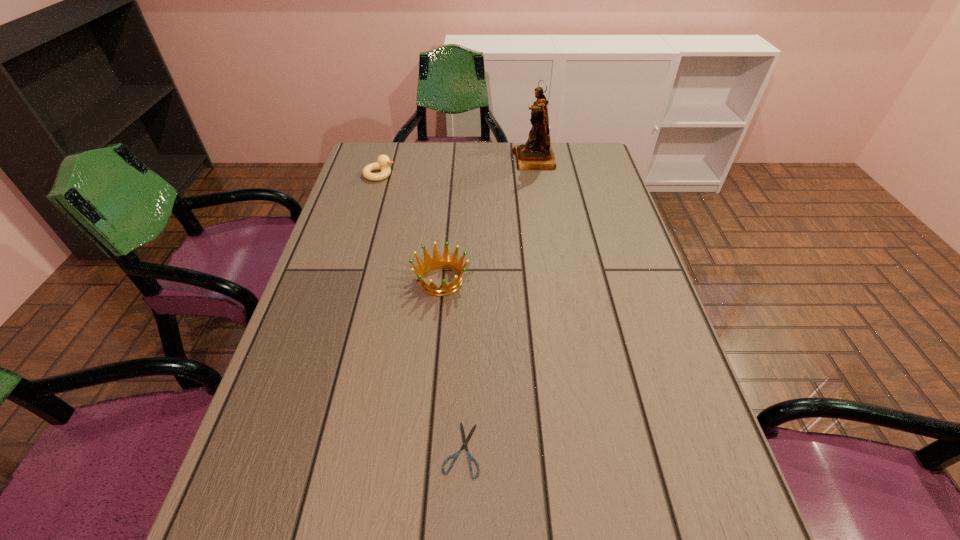
You are a GUI agent. You are given a task and a screenshot of the screen. Output one action in this format:
    pyautogui.click(x=<x>, y=<y>)
    Task: Click on the empty space between the leftmost object and the figurine
    
    Given the screenshot: What is the action you would take?
    pyautogui.click(x=457, y=167)

Find the location of a particular element. The height and width of the screenshot is (540, 960). free space between the duckling and the second nearest object is located at coordinates (410, 228).

Locate an element on the screen. This screenshot has width=960, height=540. object that is the second closest to the second nearest object is located at coordinates (383, 161).

Locate which object is the second closest to the duckling. Please provide its 2D coordinates. Your answer should be formatted as a tuple, i.e. [(x, y)], where the tuple contains the x and y coordinates of a point satisfying the conditions above.

[(536, 154)]

Where is `vacant area in the image that satisfies the following two spatial constraints: 1. at the beak of the second nearest object; 2. on the left side of the leftmost object`? vacant area in the image that satisfies the following two spatial constraints: 1. at the beak of the second nearest object; 2. on the left side of the leftmost object is located at coordinates (348, 281).

Locate an element on the screen. The image size is (960, 540). vacant space that satisfies the following two spatial constraints: 1. at the beak of the shortest object; 2. on the left side of the duckling is located at coordinates (298, 449).

Identify the location of free space that satisfies the following two spatial constraints: 1. on the front-facing side of the tallest object; 2. on the front side of the shears. (583, 449).